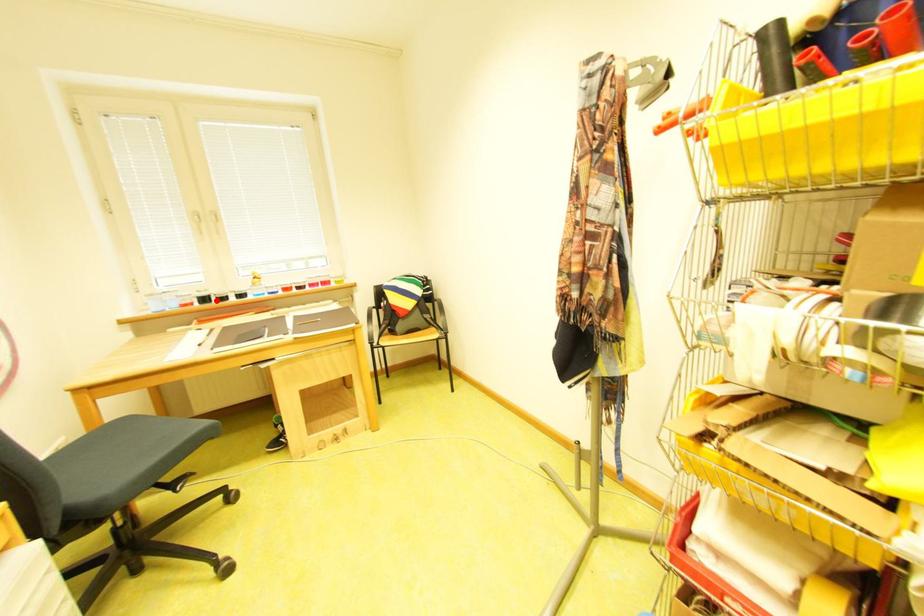
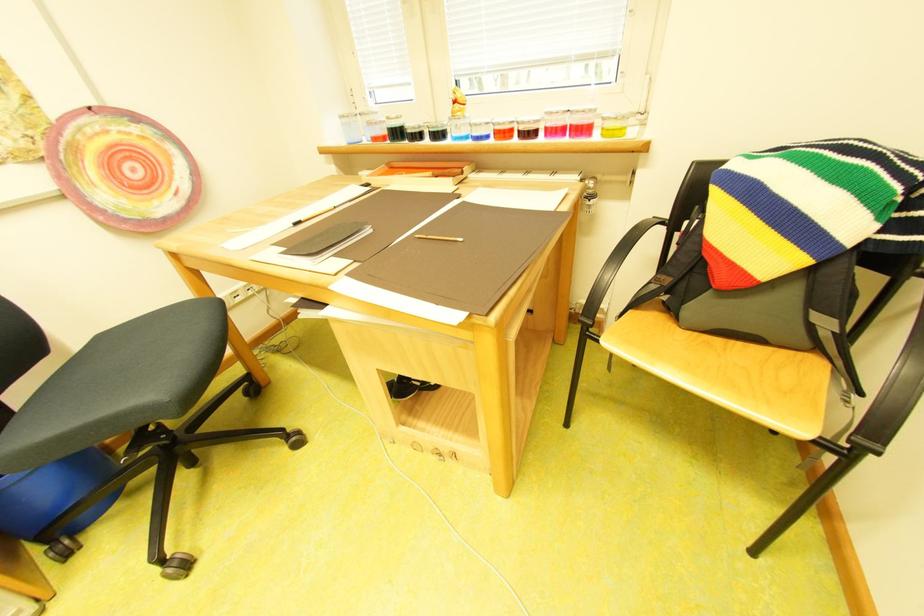
Where in the second image is the point corresponding to the highlighted location from the first image?

(407, 135)